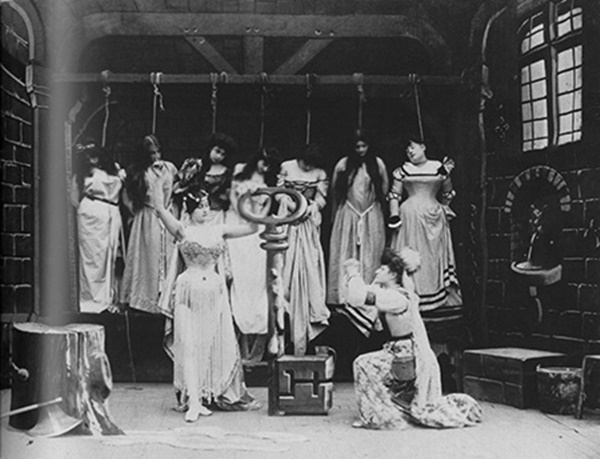
The image size is (600, 459). In order to click on black big brick wall in this screenshot , I will do `click(20, 155)`.